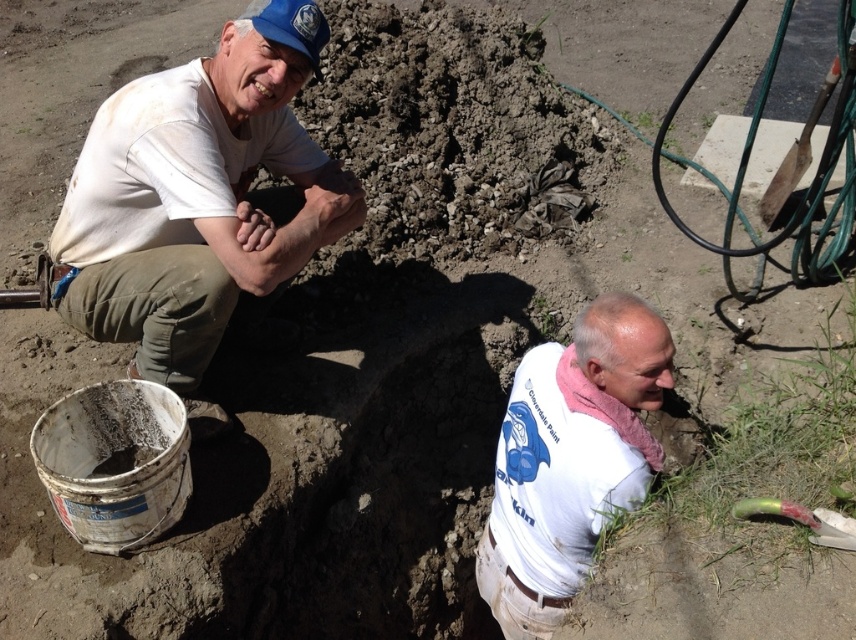
Question: Is white matte shirt at upper left thinner than white cotton shirt at lower right?

Choices:
 (A) no
 (B) yes

Answer: (A)

Question: Which point is farther from the camera taking this photo?

Choices:
 (A) (193, 317)
 (B) (498, 547)

Answer: (B)

Question: Which point is farther to the camera?

Choices:
 (A) (200, 316)
 (B) (509, 636)

Answer: (B)

Question: Can you confirm if white matte shirt at upper left is smaller than white cotton shirt at lower right?

Choices:
 (A) yes
 (B) no

Answer: (B)

Question: From the image, what is the correct spatial relationship of white matte shirt at upper left in relation to white cotton shirt at lower right?

Choices:
 (A) right
 (B) left

Answer: (B)